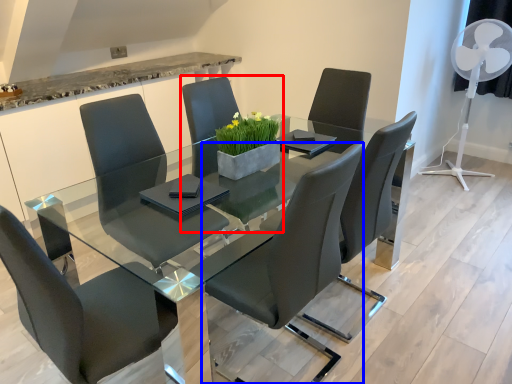
Question: Which object appears farthest to the camera in this image, chair (highlighted by a red box) or chair (highlighted by a blue box)?

Choices:
 (A) chair
 (B) chair

Answer: (A)